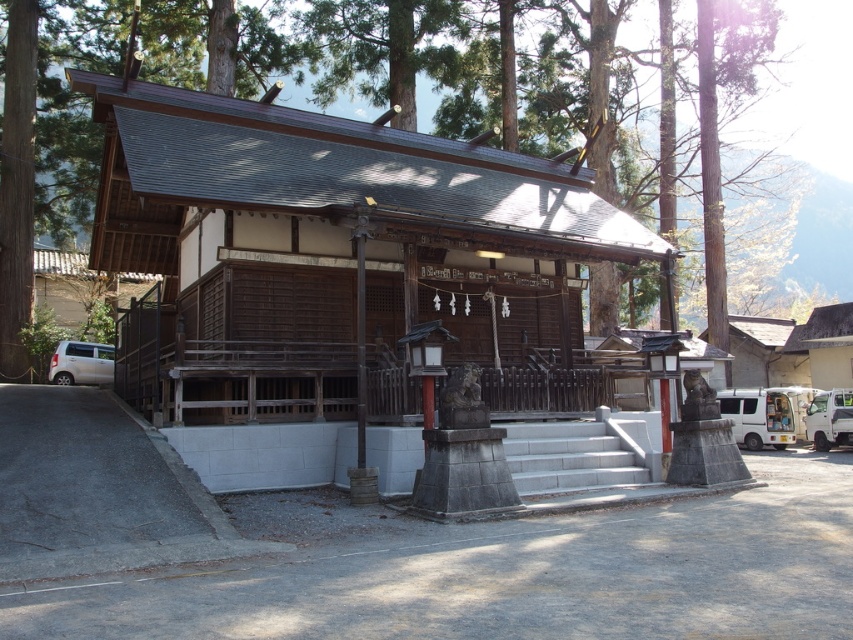
The width and height of the screenshot is (853, 640). What do you see at coordinates (578, 456) in the screenshot?
I see `gray concrete stairs at center` at bounding box center [578, 456].

The width and height of the screenshot is (853, 640). Identify the location of gray concrete stairs at center. (578, 456).

Is brown wooden tree at center below white matte van at lower right?

Actually, brown wooden tree at center is above white matte van at lower right.

Does point (245, 54) come farther from viewer compared to point (747, 428)?

Yes, it is behind point (747, 428).

Identify the location of brown wooden tree at center. (219, 68).

Which is behind, point (409, 68) or point (634, 465)?

Point (409, 68)

Which of these two, brown wooden tree at center or gray concrete stairs at center, stands shorter?

With less height is gray concrete stairs at center.

Measure the distance between brown wooden tree at center and camera.

brown wooden tree at center and camera are 14.09 meters apart from each other.

This screenshot has width=853, height=640. I want to click on brown wooden tree at center, so click(x=219, y=68).